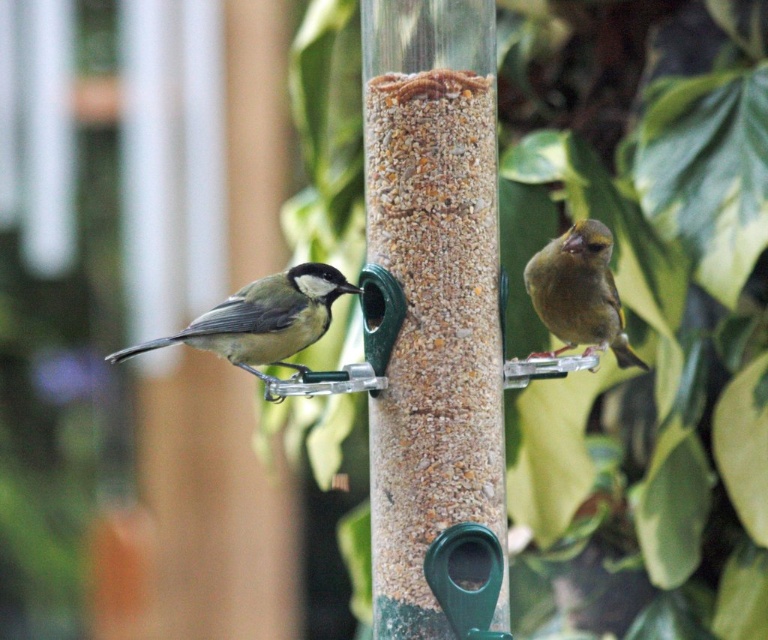
Question: Which point appears closest to the camera in this image?

Choices:
 (A) (637, 364)
 (B) (239, 296)

Answer: (B)

Question: Is matte gray bird at left closer to the viewer compared to green matte bird at right?

Choices:
 (A) no
 (B) yes

Answer: (B)

Question: Which point is closer to the camera taking this photo?

Choices:
 (A) (604, 337)
 (B) (257, 285)

Answer: (B)

Question: Does matte gray bird at left appear over green matte bird at right?

Choices:
 (A) no
 (B) yes

Answer: (A)

Question: In this image, where is matte gray bird at left located relative to green matte bird at right?

Choices:
 (A) below
 (B) above

Answer: (A)